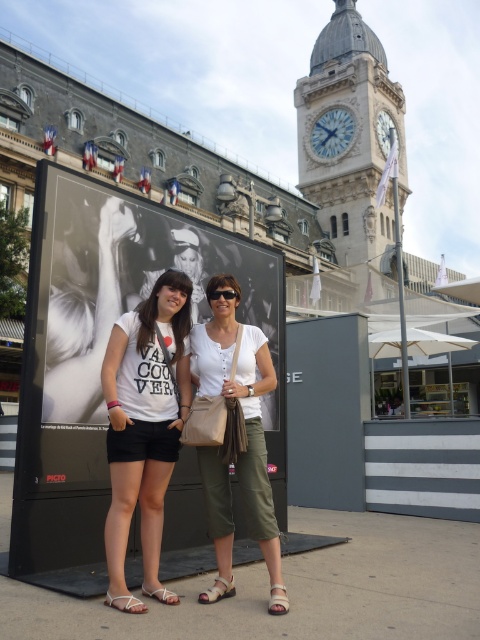
From the picture: You are a photographer trying to capture both the white leather sandal at lower center and the transparent plastic goggles at center in the same frame. Given their distance apart, will you need to adjust your camera lens to a wider angle to ensure both items are fully visible?

The white leather sandal at lower center and transparent plastic goggles at center are 10.68 meters apart. To capture both items in the same frame, you would need to use a wider angle lens to accommodate the distance between them.

You are a photographer trying to capture a photo of the white stone clock tower at upper center without any obstructions. However, there is a black glossy poster at center in the way. Based on the scene description, can you determine if the poster will block your view of the clock tower?

The black glossy poster at center is not as tall as the white stone clock tower at upper center, so part of the clock tower will still be visible above the poster.

From the picture: You are a tourist trying to take a photo of the white stone clock tower at upper center without the black glossy poster at center blocking the view. Can you move to a position where the poster is out of frame? Please explain why or why not based on their sizes.

The black glossy poster at center is smaller than the white stone clock tower at upper center. Therefore, by moving closer to the tower or adjusting your angle, you can likely position yourself so that the smaller poster doesn